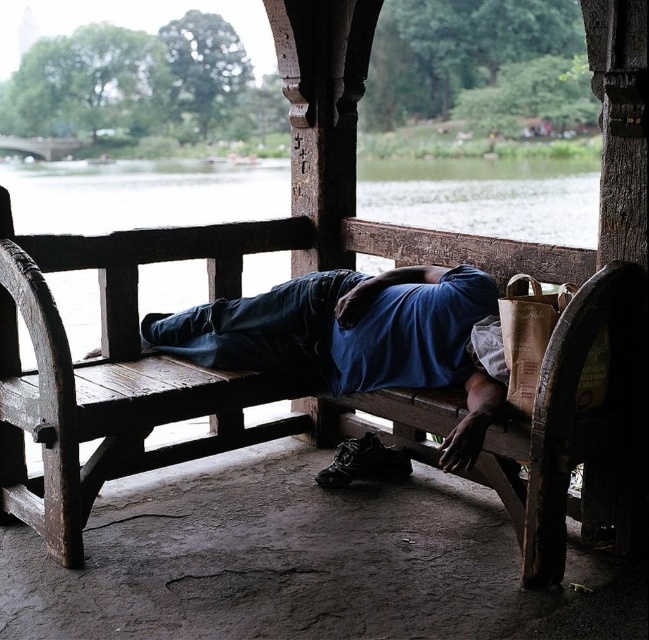
You are standing in front of the sheltered structure and want to take a photo. There are two points marked in the scene, point 1 at coordinates point (6, 333) and point 2 at coordinates point (469, 266). Which point will appear closer to the center of your camera view?

Point (6, 333) will appear closer to the center of your camera view because it is closer to the camera than point (469, 266).

You are a photographer trying to capture the rustic wood bench at center and the blue fabric at center in a single frame. Based on their heights, which object should you focus on first to ensure both are in the shot?

The rustic wood bench at center is taller than the blue fabric at center, so you should focus on the rustic wood bench at center first to ensure both are in the shot.